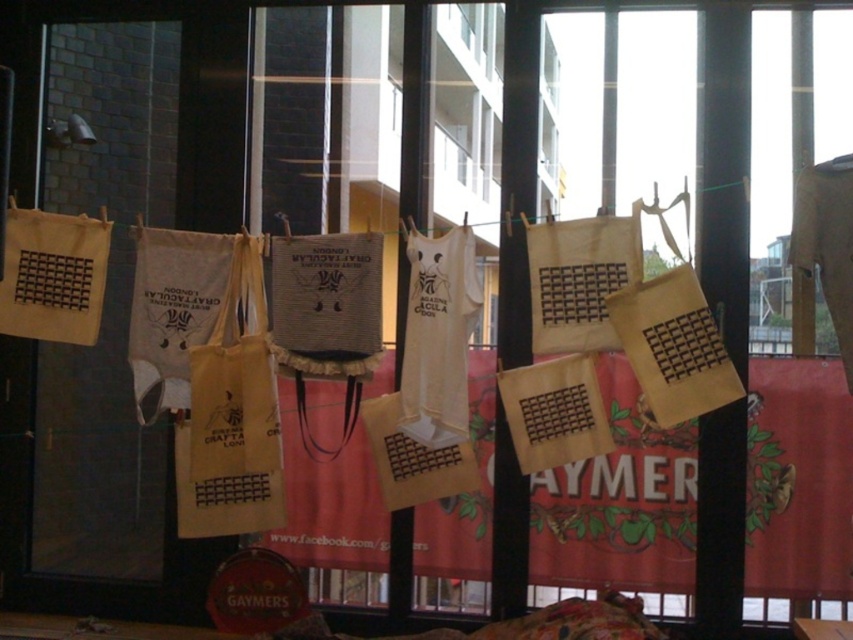
Is matte brown tote at center shorter than white cotton t-shirt at center?

No, matte brown tote at center is not shorter than white cotton t-shirt at center.

Between matte brown tote at center and white cotton t-shirt at center, which one is positioned higher?

Positioned higher is white cotton t-shirt at center.

The width and height of the screenshot is (853, 640). What are the coordinates of `matte brown tote at center` in the screenshot? It's located at (231, 416).